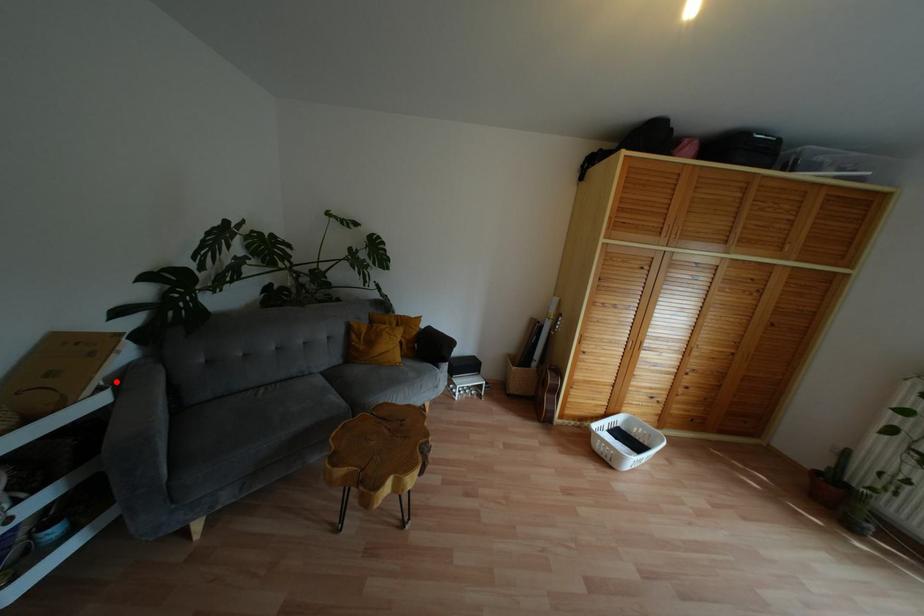
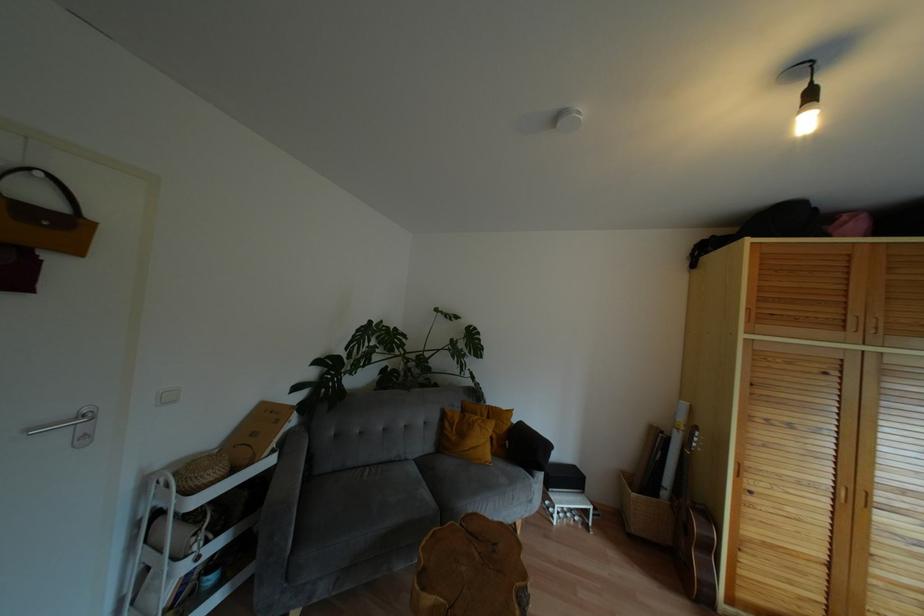
Question: I am providing you with two images of the same scene from different viewpoints. Given a red point in image1, look at the same physical point in image2. Is it:

Choices:
 (A) Closer to the viewpoint
 (B) Farther from the viewpoint

Answer: (A)